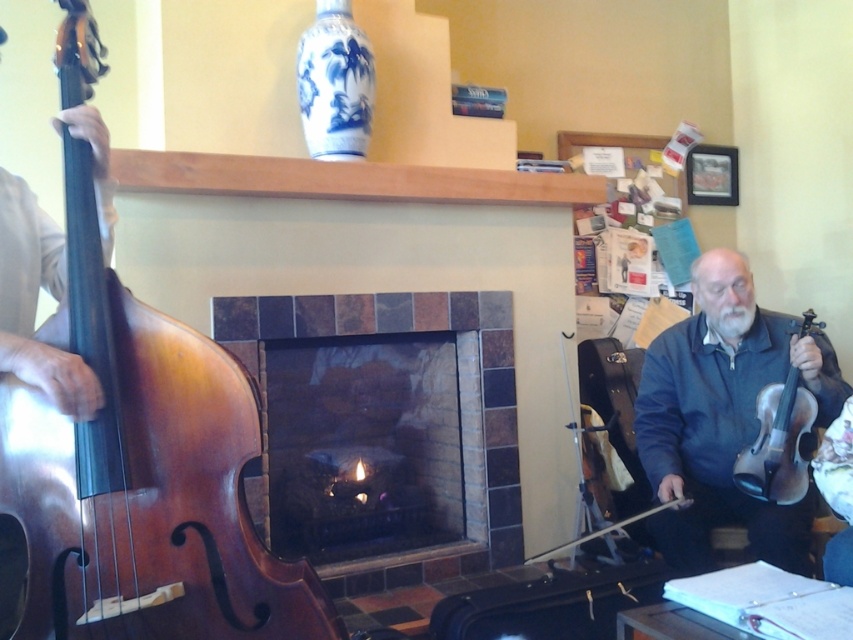
Which is behind, point (213, 477) or point (793, 406)?

The point (793, 406) is more distant.

Who is higher up, shiny brown wood cello at left or wooden violin at right?

shiny brown wood cello at left is above.

This screenshot has width=853, height=640. I want to click on shiny brown wood cello at left, so click(x=132, y=449).

Can you confirm if shiny brown wood cello at left is positioned to the left of marble tiled fireplace at center?

Indeed, shiny brown wood cello at left is positioned on the left side of marble tiled fireplace at center.

Between point (253, 417) and point (442, 545), which one is positioned behind?

The point (442, 545) is behind.

Where is `shiny brown wood cello at left`? The width and height of the screenshot is (853, 640). shiny brown wood cello at left is located at coordinates (132, 449).

Is point (189, 337) less distant than point (833, 369)?

Yes, point (189, 337) is closer to viewer.

How much distance is there between shiny brown wood cello at left and dark blue fabric jacket at right?

1.51 meters

Which is behind, point (207, 401) or point (769, 337)?

Point (769, 337)

Locate an element on the screen. The height and width of the screenshot is (640, 853). shiny brown wood cello at left is located at coordinates (132, 449).